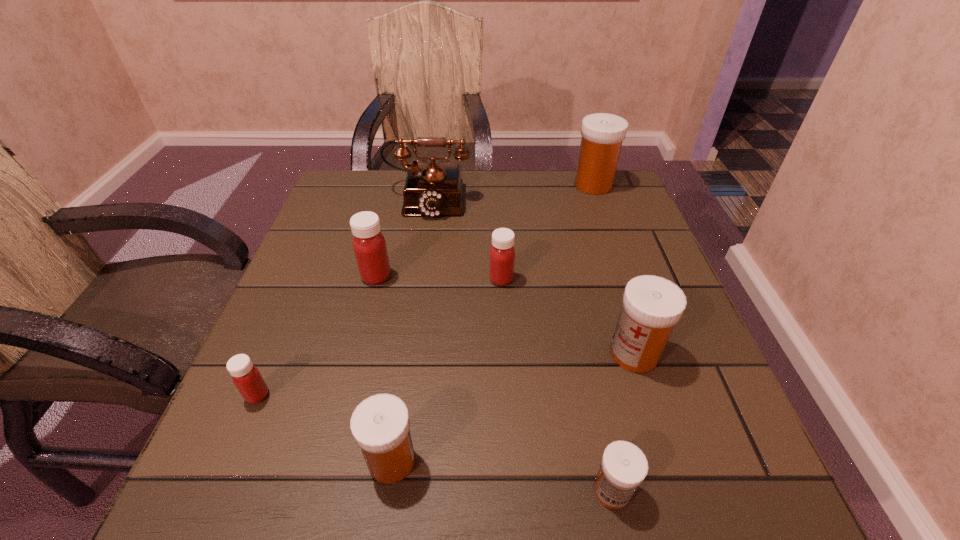
Image resolution: width=960 pixels, height=540 pixels. In order to click on free space between the biggest red medicine and the third nearest white medicine in this screenshot , I will do `click(505, 315)`.

I want to click on vacant area that lies between the third medicine from left to right and the fourth medicine from right to left, so click(446, 370).

This screenshot has height=540, width=960. In order to click on free space between the second medicine from left to right and the leftmost medicine in this screenshot , I will do coord(317,336).

Select which object appears as the seventh closest to the telephone. Please provide its 2D coordinates. Your answer should be formatted as a tuple, i.e. [(x, y)], where the tuple contains the x and y coordinates of a point satisfying the conditions above.

[(624, 466)]

Identify the location of object identified as the second closest to the fourth medicine from right to left. The height and width of the screenshot is (540, 960). (651, 305).

Identify which medicine is the sixth nearest to the third object from right to left. Please provide its 2D coordinates. Your answer should be formatted as a tuple, i.e. [(x, y)], where the tuple contains the x and y coordinates of a point satisfying the conditions above.

[(602, 134)]

I want to click on medicine that is the seventh closest one to the telephone, so click(x=624, y=466).

Locate which white medicine is the closest to the fourth medicine from left to right. Please provide its 2D coordinates. Your answer should be formatted as a tuple, i.e. [(x, y)], where the tuple contains the x and y coordinates of a point satisfying the conditions above.

[(651, 305)]

What are the coordinates of `white medicine that stands as the closest to the third white medicine from right to left` in the screenshot? It's located at (651, 305).

The image size is (960, 540). What are the coordinates of `red medicine identified as the second closest to the smallest red medicine` in the screenshot? It's located at (502, 253).